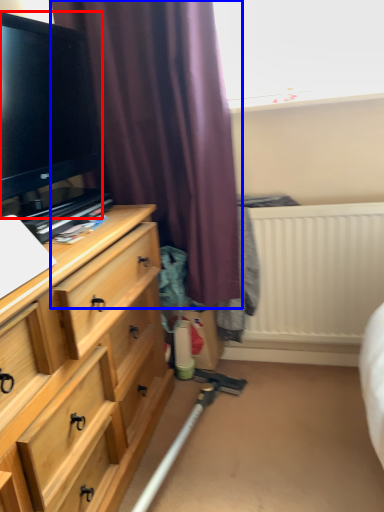
Question: Which object appears farthest to the camera in this image, television (highlighted by a red box) or curtain (highlighted by a blue box)?

Choices:
 (A) television
 (B) curtain

Answer: (B)